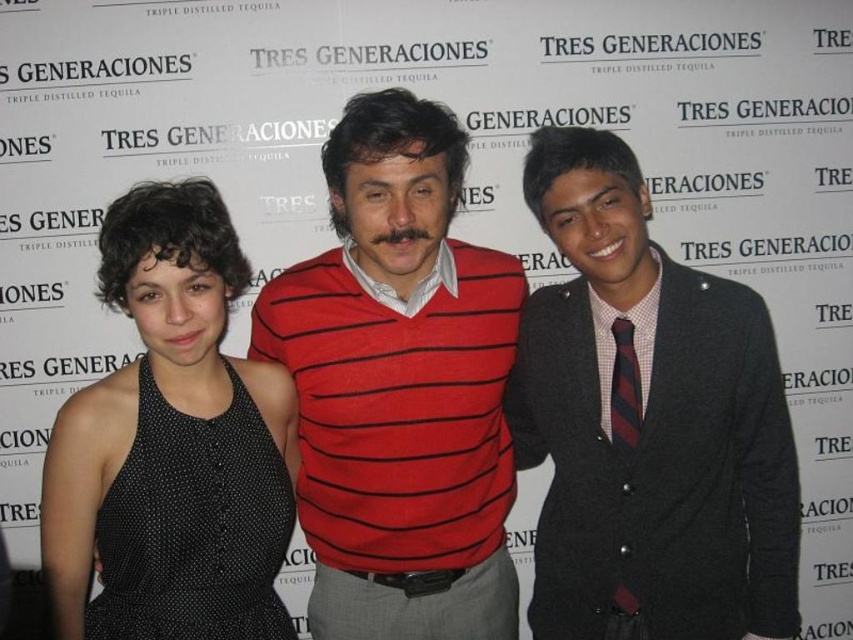
You are a photographer setting up a shoot for a tequila brand. You have two main focal points in the image, the red striped sweater at center and the black dotted dress at left. Which of these items is placed in front of the other?

The red striped sweater at center is positioned over the black dotted dress at left, meaning it is in front of the dress.

You are standing in front of the Tres Generaciones tequila backdrop and see two points marked on the image. The first point is at coordinate point (572, 609) and the second is at point (315, 504). Which point is closer to you?

Point (572, 609) is in front of point (315, 504), so the first point is closer to you.